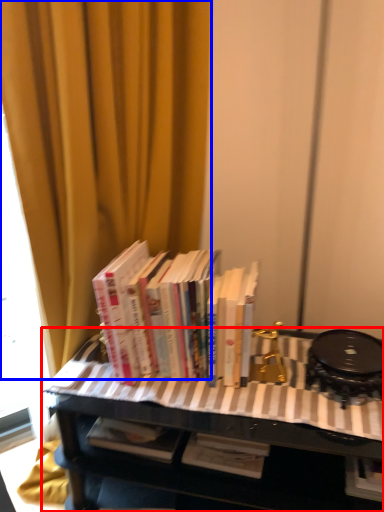
Question: Which point is further to the camera, table (highlighted by a red box) or curtain (highlighted by a blue box)?

Choices:
 (A) table
 (B) curtain

Answer: (A)